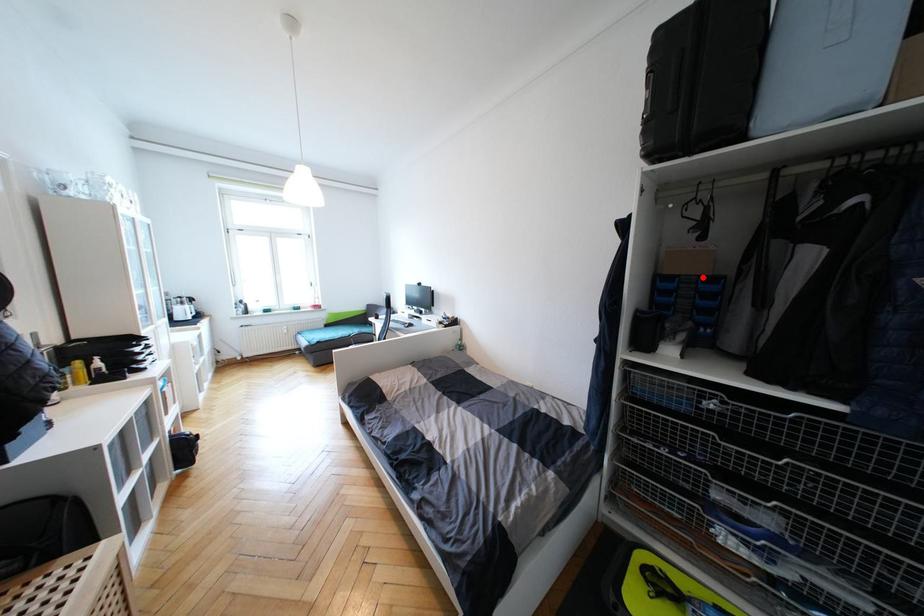
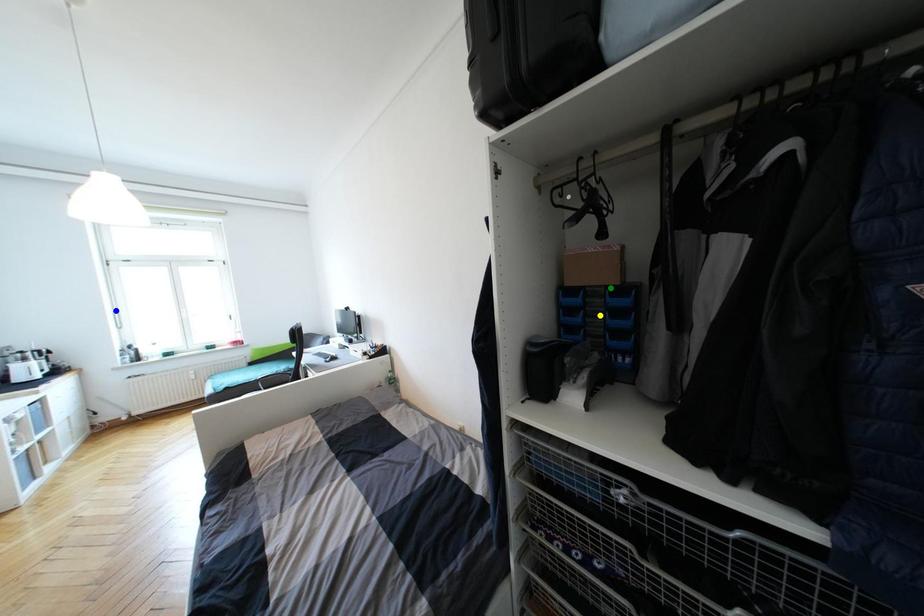
Question: I am providing you with two images of the same scene from different viewpoints. A red point is marked on the first image. You are given multiple points on the second image. Which point in image 2 is actually the same real-world point as the red point in image 1?

Choices:
 (A) yellow point
 (B) green point
 (C) blue point

Answer: (B)